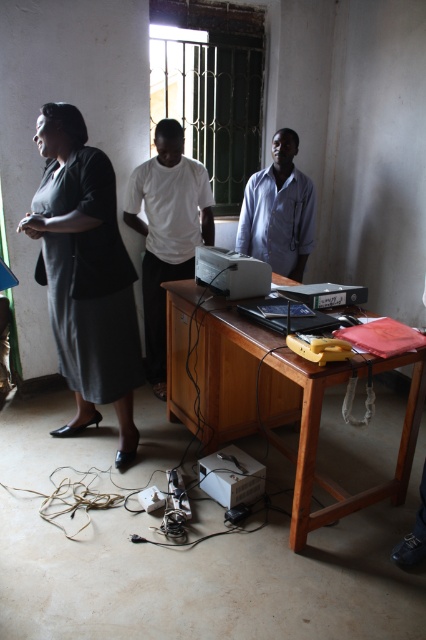
Does black matte laptop at center have a greater width compared to black plastic hard drive at center?

Indeed, black matte laptop at center has a greater width compared to black plastic hard drive at center.

Looking at this image, is black matte laptop at center shorter than black plastic hard drive at center?

No.

The height and width of the screenshot is (640, 426). What do you see at coordinates (264, 310) in the screenshot? I see `black matte laptop at center` at bounding box center [264, 310].

I want to click on black matte laptop at center, so click(264, 310).

Between point (273, 321) and point (340, 346), which one is positioned in front?

Point (340, 346) is in front.

Based on the photo, who is shorter, black matte laptop at center or yellow plastic bag at lower right?

yellow plastic bag at lower right is shorter.

Which is in front, point (285, 323) or point (337, 355)?

Positioned in front is point (337, 355).

Where is `black matte laptop at center`? The height and width of the screenshot is (640, 426). black matte laptop at center is located at coordinates (264, 310).

Which of these two, white plastic printer at center or black matte laptop at center, stands shorter?

Standing shorter between the two is black matte laptop at center.

Does white plastic printer at center have a smaller size compared to black matte laptop at center?

Actually, white plastic printer at center might be larger than black matte laptop at center.

Is point (256, 276) positioned behind point (331, 330)?

Yes, point (256, 276) is farther from viewer.

The width and height of the screenshot is (426, 640). Find the location of `white plastic printer at center`. white plastic printer at center is located at coordinates (230, 273).